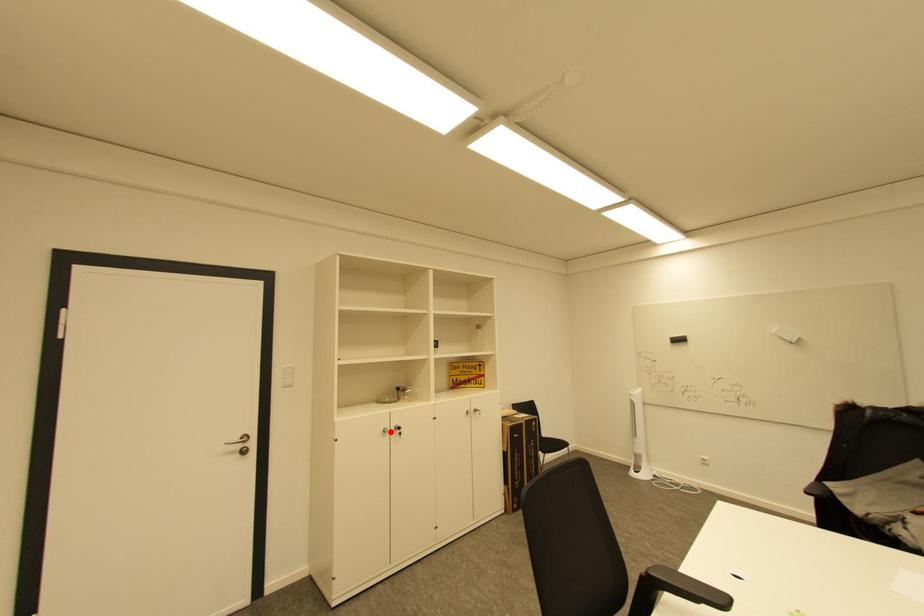
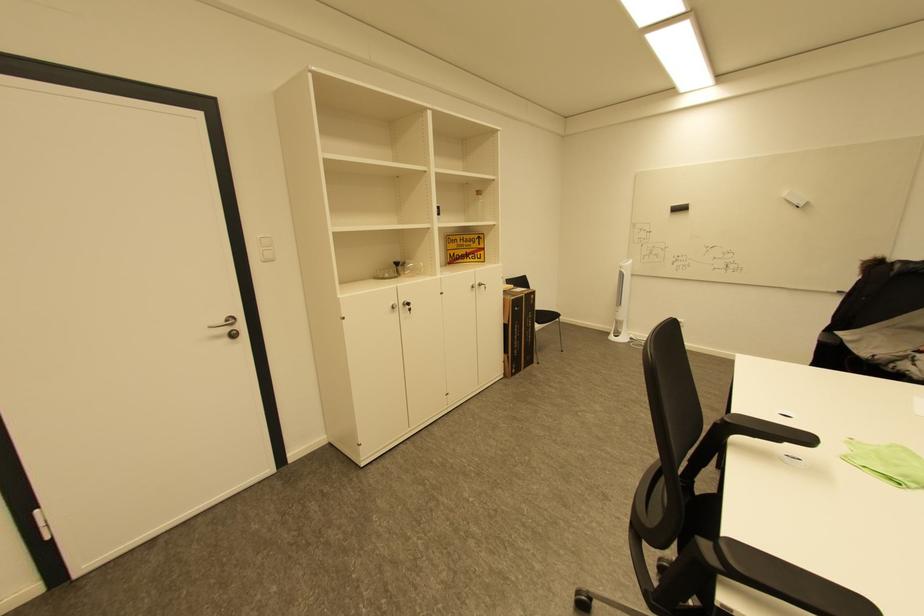
Find the pixel in the second image that matches the highlighted location in the first image.

(398, 308)